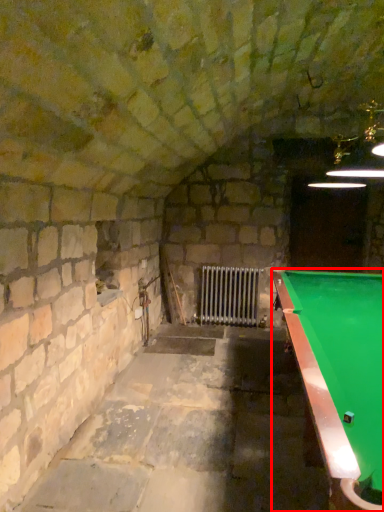
Question: From the image's perspective, what is the correct spatial relationship of billiard table (annotated by the red box) in relation to radiator?

Choices:
 (A) below
 (B) above

Answer: (A)